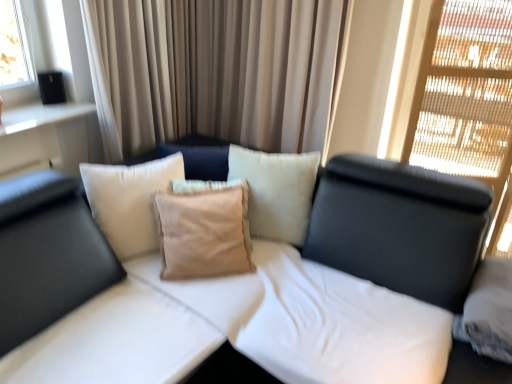
This screenshot has width=512, height=384. I want to click on translucent wood screen at upper right, so click(x=465, y=93).

This screenshot has height=384, width=512. What do you see at coordinates (216, 71) in the screenshot? I see `satin beige curtain at center` at bounding box center [216, 71].

Measure the distance between point (x=314, y=205) and camera.

Point (x=314, y=205) is 6.43 feet away from camera.

Based on the photo, measure the distance between white fabric studio couch at center and camera.

The depth of white fabric studio couch at center is 4.42 feet.

At what (x,y) coordinates should I click in order to perform the action: click on translucent wood screen at upper right. Please return your answer as a coordinate pair (x, y). Looking at the image, I should click on (465, 93).

Considering the sizes of translucent wood screen at upper right and white fabric studio couch at center in the image, is translucent wood screen at upper right wider or thinner than white fabric studio couch at center?

Considering their sizes, translucent wood screen at upper right looks slimmer than white fabric studio couch at center.

Who is taller, translucent wood screen at upper right or white fabric studio couch at center?

translucent wood screen at upper right.

Is translucent wood screen at upper right positioned far away from white fabric studio couch at center?

translucent wood screen at upper right is near white fabric studio couch at center, not far away.

From the picture: How different are the orientations of translucent wood screen at upper right and white fabric studio couch at center in degrees?

4.18 degrees.

From a real-world perspective, is satin beige curtain at center positioned above or below translucent wood screen at upper right?

satin beige curtain at center is situated higher than translucent wood screen at upper right in the real world.

How many degrees apart are the facing directions of satin beige curtain at center and translucent wood screen at upper right?

The angle between the facing direction of satin beige curtain at center and the facing direction of translucent wood screen at upper right is 4.18 degrees.

Consider the image. Choose the correct answer: Is satin beige curtain at center inside translucent wood screen at upper right or outside it?

satin beige curtain at center is not enclosed by translucent wood screen at upper right.

Is satin beige curtain at center taller or shorter than translucent wood screen at upper right?

satin beige curtain at center is shorter than translucent wood screen at upper right.

The width and height of the screenshot is (512, 384). Find the location of `glass door located below the satin beige curtain at center (from the image's perspective)`. glass door located below the satin beige curtain at center (from the image's perspective) is located at coordinates (465, 93).

Which object is thinner, translucent wood screen at upper right or satin beige curtain at center?

satin beige curtain at center is thinner.

Is translucent wood screen at upper right inside the boundaries of satin beige curtain at center, or outside?

The correct answer is: outside.

You are a GUI agent. You are given a task and a screenshot of the screen. Output one action in this format:
    pyautogui.click(x=<x>, y=<y>)
    Task: Click on the pillow on the left side of satin beige curtain at center
    Image resolution: width=512 pixels, height=384 pixels.
    Given the screenshot: What is the action you would take?
    pyautogui.click(x=202, y=233)

In terms of height, does satin beige curtain at center look taller or shorter compared to suede beige pillow at center?

Considering their sizes, satin beige curtain at center has more height than suede beige pillow at center.

Could you tell me if satin beige curtain at center is facing suede beige pillow at center?

Yes, satin beige curtain at center faces towards suede beige pillow at center.

From the image's perspective, which is above, suede beige pillow at center or translucent wood screen at upper right?

translucent wood screen at upper right.

Is suede beige pillow at center not within translucent wood screen at upper right?

suede beige pillow at center is positioned outside translucent wood screen at upper right.

Does suede beige pillow at center turn towards translucent wood screen at upper right?

No, suede beige pillow at center is not aimed at translucent wood screen at upper right.

Who is shorter, suede beige pillow at center or translucent wood screen at upper right?

suede beige pillow at center is shorter.

From a real-world perspective, which is physically below, translucent wood screen at upper right or suede beige pillow at center?

suede beige pillow at center, from a real-world perspective.

Would you consider translucent wood screen at upper right to be distant from suede beige pillow at center?

Yes.

Where is `pillow on the left of translucent wood screen at upper right`? This screenshot has height=384, width=512. pillow on the left of translucent wood screen at upper right is located at coordinates (202, 233).

Does satin beige curtain at center have a greater width compared to white fabric studio couch at center?

Incorrect, the width of satin beige curtain at center does not surpass that of white fabric studio couch at center.

Is satin beige curtain at center oriented away from white fabric studio couch at center?

That's not correct — satin beige curtain at center is not looking away from white fabric studio couch at center.

From the image's perspective, which object appears higher, satin beige curtain at center or white fabric studio couch at center?

satin beige curtain at center, from the image's perspective.

I want to click on studio couch below the satin beige curtain at center (from the image's perspective), so click(243, 294).

At what (x,y) coordinates should I click in order to perform the action: click on glass door located on the right of white fabric studio couch at center. Please return your answer as a coordinate pair (x, y). The image size is (512, 384). Looking at the image, I should click on (465, 93).

The width and height of the screenshot is (512, 384). In the image, there is a satin beige curtain at center. What are the coordinates of `glass door below it (from a real-world perspective)` in the screenshot? It's located at (465, 93).

Estimate the real-world distances between objects in this image. Which object is further from white fabric studio couch at center, suede beige pillow at center or satin beige curtain at center?

Among the two, satin beige curtain at center is located further to white fabric studio couch at center.

When comparing their distances from satin beige curtain at center, does white fabric studio couch at center or translucent wood screen at upper right seem closer?

white fabric studio couch at center lies closer to satin beige curtain at center than the other object.

Which object lies nearer to the anchor point satin beige curtain at center, translucent wood screen at upper right or suede beige pillow at center?

suede beige pillow at center.

When comparing their distances from suede beige pillow at center, does satin beige curtain at center or translucent wood screen at upper right seem further?

The object further to suede beige pillow at center is translucent wood screen at upper right.

From the image, which object appears to be nearer to translucent wood screen at upper right, suede beige pillow at center or satin beige curtain at center?

satin beige curtain at center lies closer to translucent wood screen at upper right than the other object.

When comparing their distances from white fabric studio couch at center, does satin beige curtain at center or suede beige pillow at center seem closer?

Among the two, suede beige pillow at center is located nearer to white fabric studio couch at center.

Estimate the real-world distances between objects in this image. Which object is further from translucent wood screen at upper right, satin beige curtain at center or white fabric studio couch at center?

Among the two, satin beige curtain at center is located further to translucent wood screen at upper right.

Looking at the image, which one is located closer to suede beige pillow at center, white fabric studio couch at center or satin beige curtain at center?

The object closer to suede beige pillow at center is white fabric studio couch at center.

At what (x,y) coordinates should I click in order to perform the action: click on curtain between suede beige pillow at center and translucent wood screen at upper right in the horizontal direction. Please return your answer as a coordinate pair (x, y). This screenshot has width=512, height=384. Looking at the image, I should click on (216, 71).

Identify the location of pillow positioned between white fabric studio couch at center and satin beige curtain at center from near to far. This screenshot has width=512, height=384. (202, 233).

You are a GUI agent. You are given a task and a screenshot of the screen. Output one action in this format:
    pyautogui.click(x=<x>, y=<y>)
    Task: Click on the studio couch between suede beige pillow at center and translucent wood screen at upper right in the horizontal direction
    
    Given the screenshot: What is the action you would take?
    pyautogui.click(x=243, y=294)

Where is `glass door between white fabric studio couch at center and satin beige curtain at center in the front-back direction`? Image resolution: width=512 pixels, height=384 pixels. glass door between white fabric studio couch at center and satin beige curtain at center in the front-back direction is located at coordinates (465, 93).